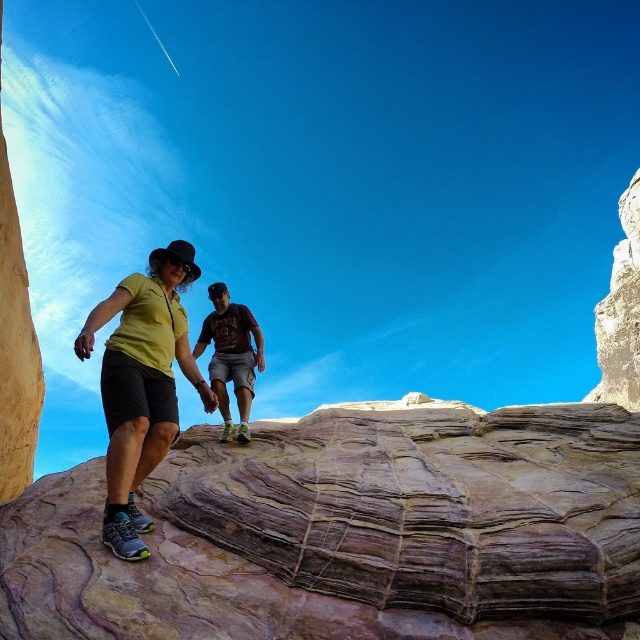
Can you confirm if matte yellow shirt at center is wider than matte brown t-shirt at center?

Indeed, matte yellow shirt at center has a greater width compared to matte brown t-shirt at center.

Does matte yellow shirt at center appear over matte brown t-shirt at center?

No, matte yellow shirt at center is not above matte brown t-shirt at center.

Measure the distance between matte yellow shirt at center and camera.

The distance of matte yellow shirt at center from camera is 86.30 feet.

This screenshot has height=640, width=640. Find the location of `matte yellow shirt at center`. matte yellow shirt at center is located at coordinates (141, 385).

Between point (259, 627) and point (168, 257), which one is positioned in front?

Point (259, 627) is in front.

Which is below, rustic stone rock at center or matte yellow shirt at center?

A: rustic stone rock at center is below.

Where is `rustic stone rock at center`? Image resolution: width=640 pixels, height=640 pixels. rustic stone rock at center is located at coordinates (348, 532).

Find the location of a particular element. rustic stone rock at center is located at coordinates click(x=348, y=532).

Is point (289, 547) in front of point (228, 336)?

Yes, point (289, 547) is closer to viewer.

Which is more to the left, rustic stone rock at center or matte brown t-shirt at center?

Positioned to the left is matte brown t-shirt at center.

What do you see at coordinates (348, 532) in the screenshot?
I see `rustic stone rock at center` at bounding box center [348, 532].

Locate an element on the screen. This screenshot has width=640, height=640. rustic stone rock at center is located at coordinates (348, 532).